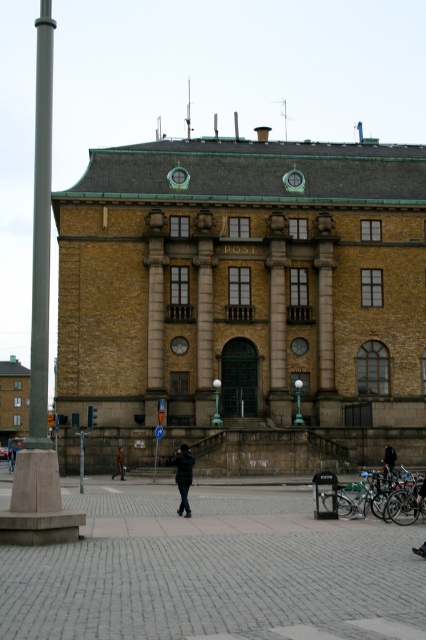
You are standing at the entrance of the historic building and see both the dark blue jacket at center and the black leather jacket at lower center. Which jacket is closer to you?

The black leather jacket at lower center is closer to you because it is positioned at lower center, which is typically nearer in such scenes compared to the dark blue jacket at center.